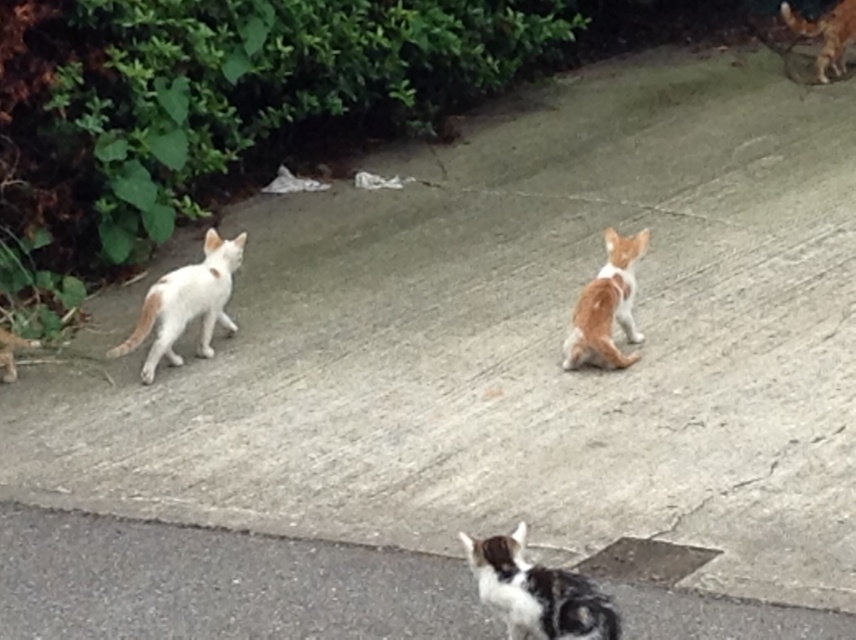
You are a cat owner who wants to take a photo of the white fur cat at left and the orange fur cat at upper right. Based on their positions, which cat should you focus on first if you want to capture both in the frame without moving your camera?

The white fur cat at left is to the left of the orange fur cat at upper right, so you should focus on the white fur cat at left first to ensure both are in the frame.

You are a photographer standing at the edge of the concrete surface where the calico fur cat at lower center and the orange fur cat at center are located. You want to take a photo that includes both cats without moving them. Given that your camera has a maximum zoom range that can capture objects up to 5 feet apart, will you be able to capture both cats in a single frame?

The calico fur cat at lower center is 5.74 feet from the orange fur cat at center. Since the distance between them exceeds the camera maximum zoom range of 5 feet, you will not be able to capture both cats in a single frame without moving them.

You are a cat owner who wants to ensure your cats are safe. You have a cat leash that is 3 meters long. If you are holding the leash at the position of the white fur cat at left, can you reach the orange fur cat at upper right without moving your position?

The distance between the white fur cat at left and the orange fur cat at upper right is 3.88 meters. Since the leash is only 3 meters long, you cannot reach the orange fur cat at upper right without moving your position.